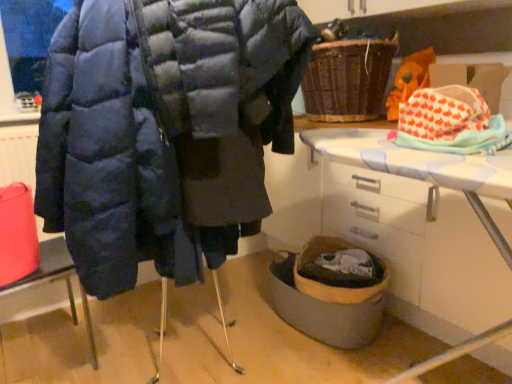
Question: Is point (158, 26) closer or farther from the camera than point (49, 269)?

Choices:
 (A) farther
 (B) closer

Answer: (B)

Question: Is matte blue puffer jacket at center inside the boundaries of matte black coat at left, or outside?

Choices:
 (A) inside
 (B) outside

Answer: (B)

Question: Which object is the farthest from the white cotton fabric at upper right?

Choices:
 (A) matte blue puffer jacket at center
 (B) woven brown basket at upper center
 (C) wooden woven basket at lower center
 (D) matte black coat at left
 (E) white plastic table at lower right

Answer: (D)

Question: Considering the real-world distances, which object is farthest from the matte black coat at left?

Choices:
 (A) woven brown basket at upper center
 (B) white cotton fabric at upper right
 (C) wooden woven basket at lower center
 (D) white plastic table at lower right
 (E) matte blue puffer jacket at center

Answer: (A)